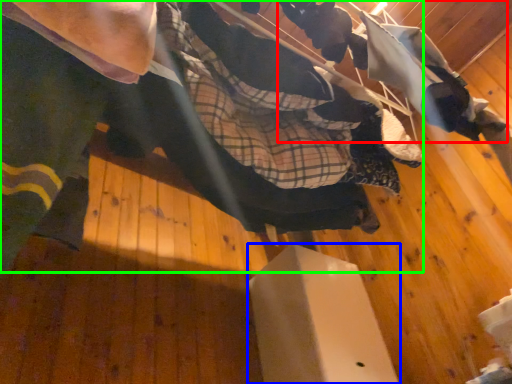
Question: Estimate the real-world distances between objects in this image. Which object is closer to squat (highlighted by a red box), furniture (highlighted by a blue box) or skateboarder (highlighted by a green box)?

Choices:
 (A) furniture
 (B) skateboarder

Answer: (B)